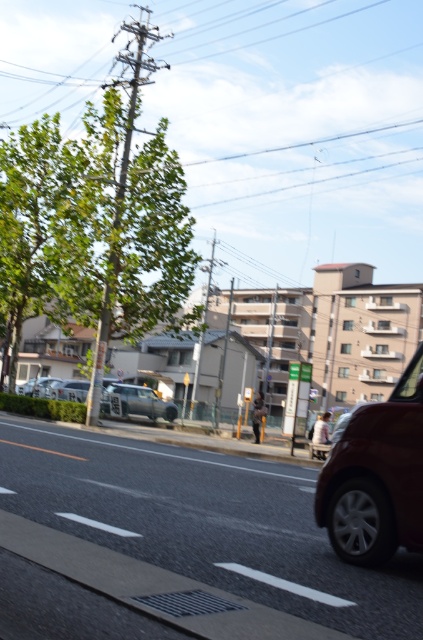
Consider the image. Who is taller, satin silver car at center or matte silver car at center?

satin silver car at center

You are a GUI agent. You are given a task and a screenshot of the screen. Output one action in this format:
    pyautogui.click(x=<x>, y=<y>)
    Task: Click on the satin silver car at center
    This screenshot has height=640, width=423.
    Given the screenshot: What is the action you would take?
    pyautogui.click(x=142, y=401)

Image resolution: width=423 pixels, height=640 pixels. Find the location of `satin silver car at center`. satin silver car at center is located at coordinates (142, 401).

Describe the element at coordinates (376, 477) in the screenshot. The height and width of the screenshot is (640, 423). I see `satin red car at right` at that location.

Who is more forward, [356,428] or [63,387]?

Point [356,428] is in front.

Where is `satin red car at right`? satin red car at right is located at coordinates (376, 477).

Can you confirm if silver metallic car at center is positioned to the left of matte silver car at center?

Incorrect, silver metallic car at center is not on the left side of matte silver car at center.

Who is higher up, silver metallic car at center or matte silver car at center?

silver metallic car at center is above.

Is point (80, 392) in front of point (43, 387)?

Yes.

The image size is (423, 640). I want to click on silver metallic car at center, so click(x=68, y=390).